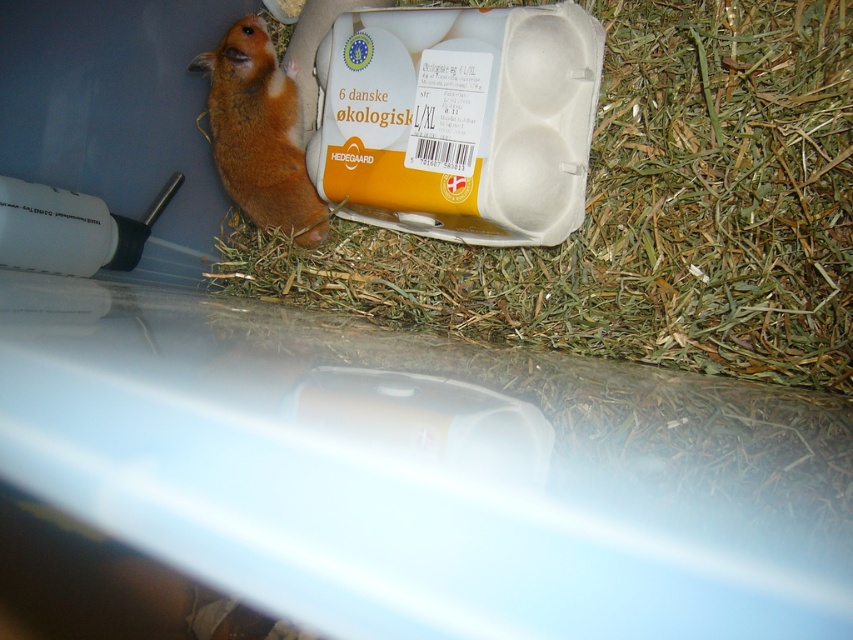
You are a pet owner who wants to place a new toy for your hamster. The enclosure has a green straw at upper center and an orange fur hamster at left. Which object is closer to you so you can easily reach it to place the toy?

The green straw at upper center is closer to the viewer than the orange fur hamster at left, so you can easily reach it to place the toy.

Consider the image. You are a small toy mouse that is 3 inches tall. You are placed in the enclosure and want to hide behind an object that is taller than you. Which object between the green straw at upper center and the orange fur hamster at left can you hide behind?

The green straw at upper center is taller than the orange fur hamster at left, so the toy mouse can hide behind the green straw at upper center since it is taller than the mouse.

You are a small toy mouse that is 3 inches long. You are placed in the enclosure and want to move from the green straw at upper center to the orange fur hamster at left. Can you fit through the space between them without bending?

The distance between the green straw at upper center and the orange fur hamster at left is 12.02 inches. Since the toy mouse is only 3 inches long, it can easily move through the space between them without needing to bend.